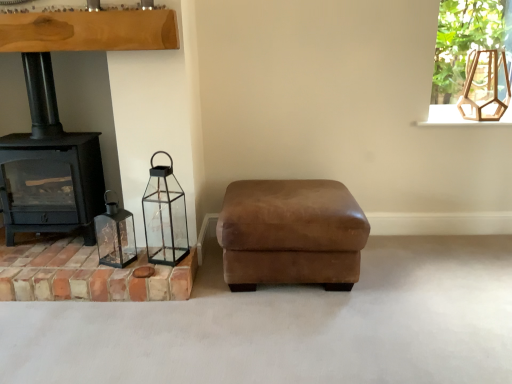
Image resolution: width=512 pixels, height=384 pixels. Find the location of `free spot behind matte glass lantern at left, arranged as the second candle holder when viewed from the right`. free spot behind matte glass lantern at left, arranged as the second candle holder when viewed from the right is located at coordinates (120, 246).